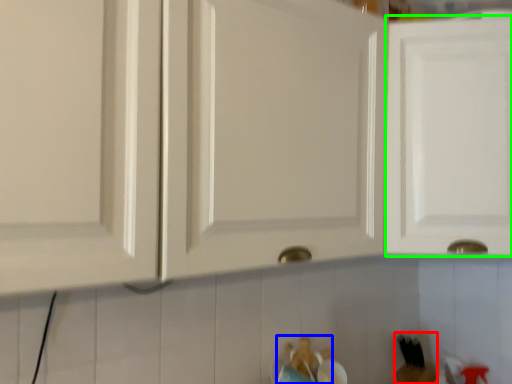
Question: Which object is the closest to the toy (highlighted by a red box)? Choose among these: toy (highlighted by a blue box) or cabinetry (highlighted by a green box).

Choices:
 (A) toy
 (B) cabinetry

Answer: (A)